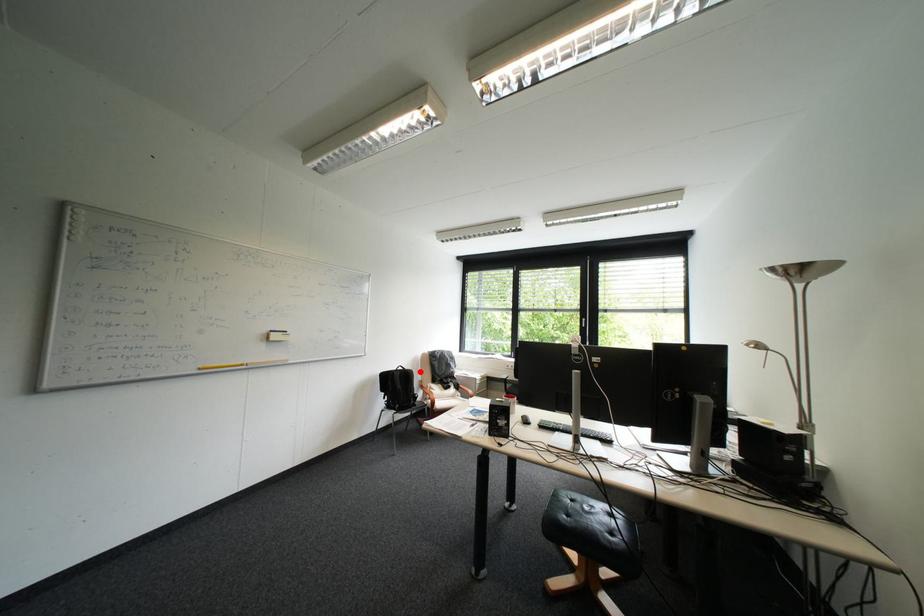
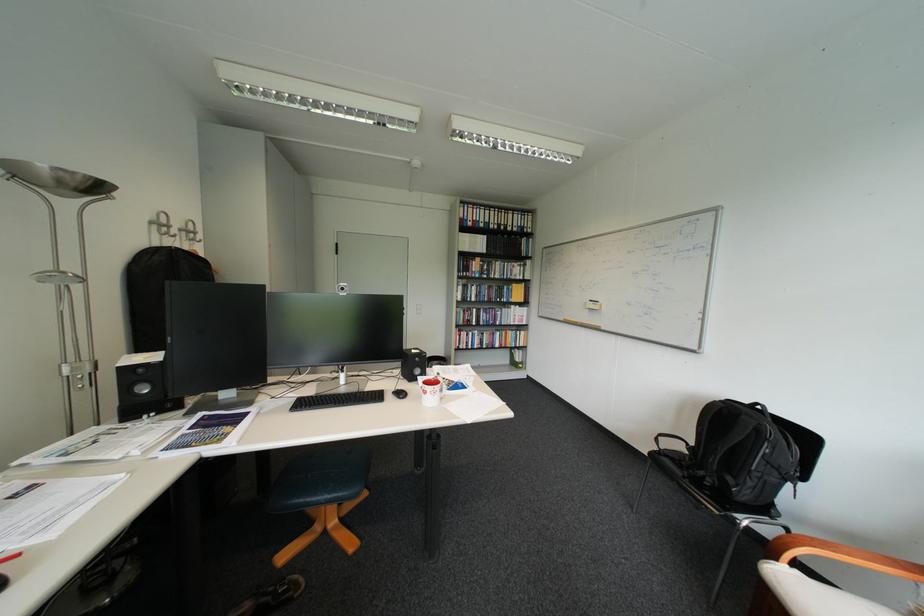
Question: I am providing you with two images of the same scene from different viewpoints. A red point is shown in image1. For the corresponding object point in image2, is it positioned nearer or farther from the camera?

Choices:
 (A) Nearer
 (B) Farther

Answer: (A)